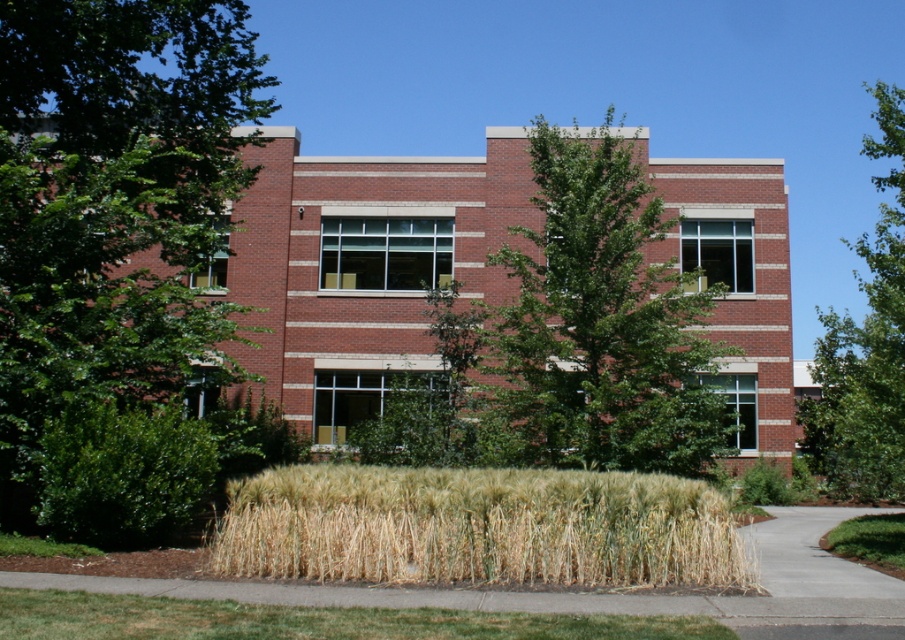
Looking at this image, you are a landscape architect planning to install a new bench in this area. The bench requires a space where both the green leafy tree at left and the dry straw at lower center are visible. Based on their heights, which object might block the view of the other if placed between them?

The green leafy tree at left is taller than the dry straw at lower center, so if placed between them, the green leafy tree at left could block the view of the dry straw at lower center.

You are standing on the paved pathway that curves towards the right side of the building. Looking at the green leafy tree at left and the green grass at lower center, which one is higher up in the scene?

The green leafy tree at left is located above the green grass at lower center, so it is higher up in the scene.

You are a gardener planning to plant flowers in the landscaped area. You notice the dry straw at lower center and the green grass at lower center. Which material should you choose to cover the soil to prevent weeds, considering their thickness?

The dry straw at lower center is thinner than the green grass at lower center, so the green grass at lower center would be more effective at covering the soil and preventing weeds due to its greater thickness.